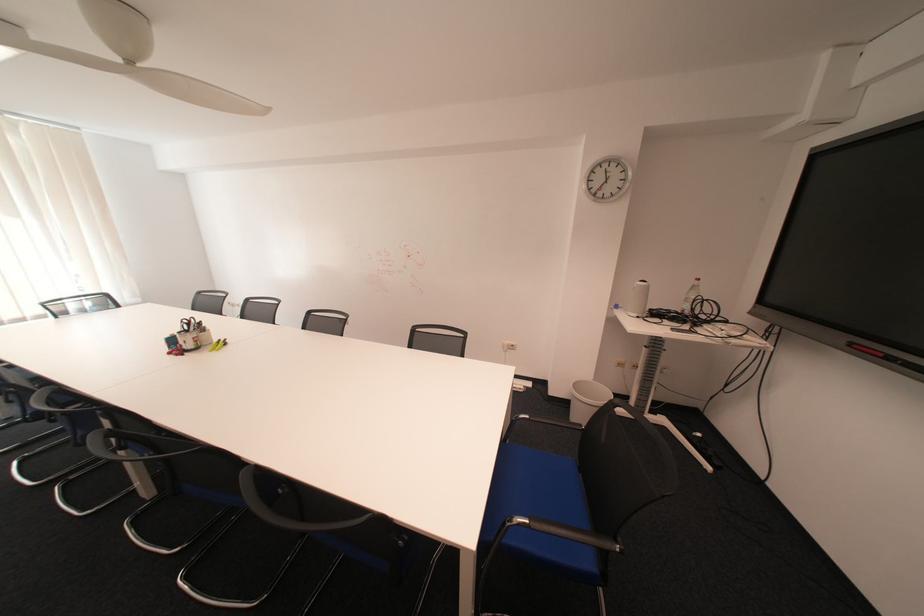
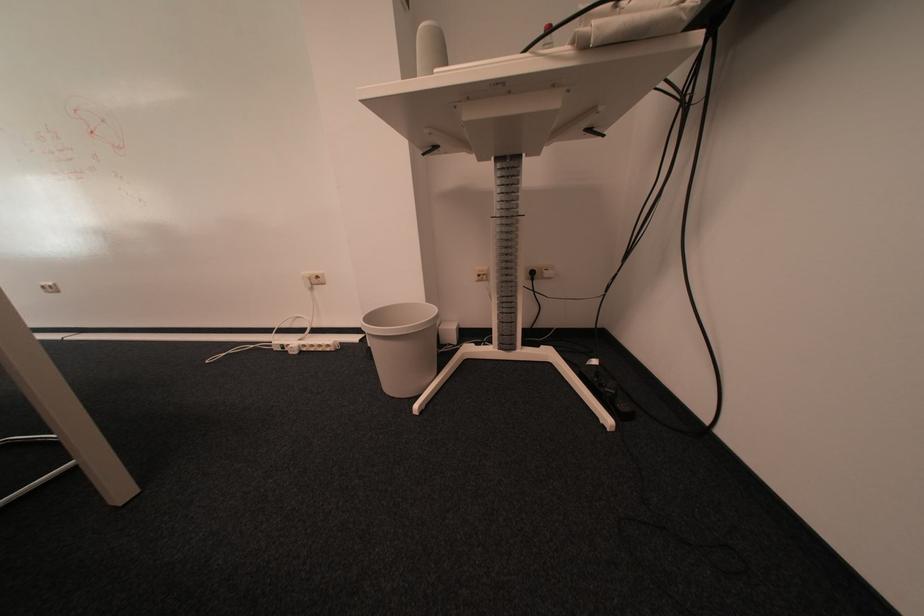
From the picture: In a continuous first-person perspective shot, in which direction is the camera moving?

The movement direction of the cameraman is right, forward.